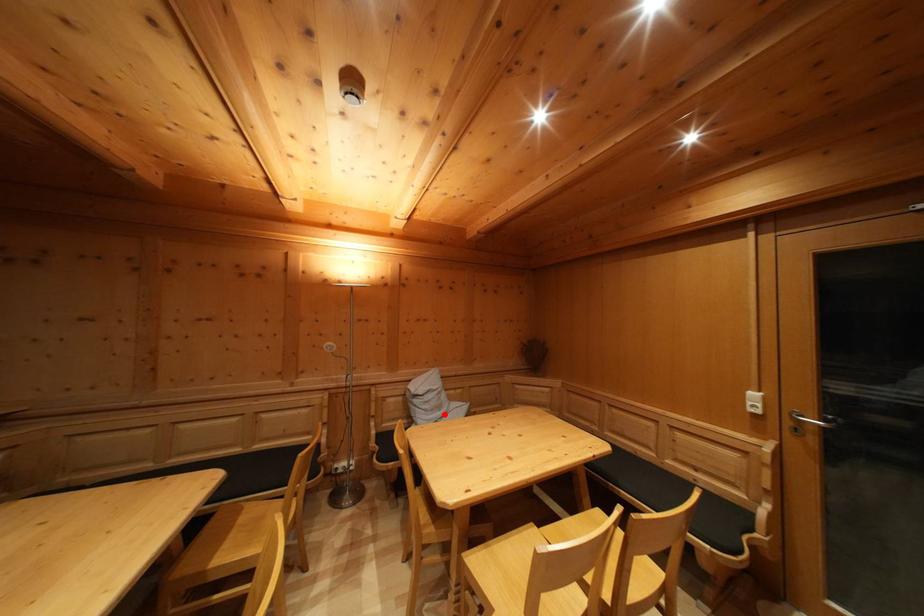
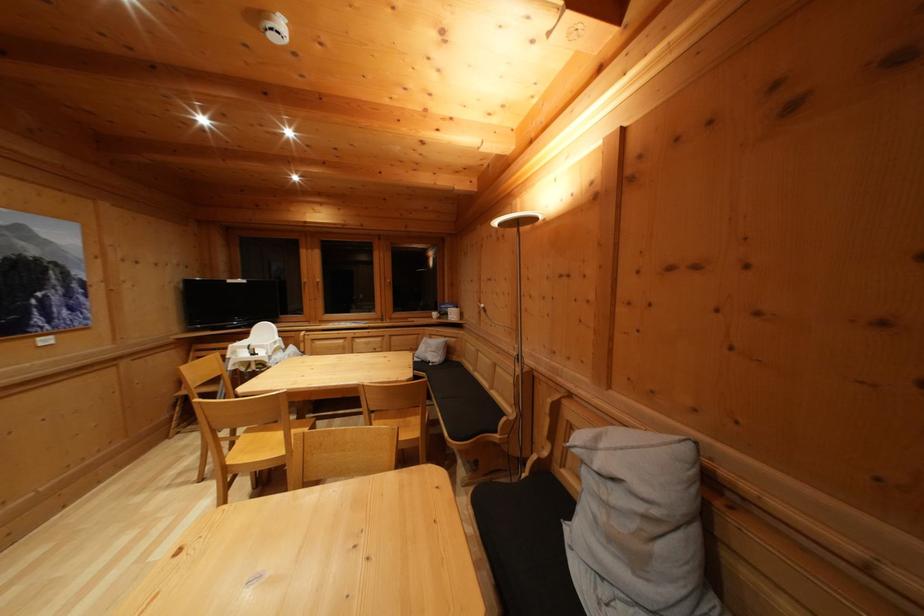
Question: I am providing you with two images of the same scene from different viewpoints. Given a red point in image1, look at the same physical point in image2. Is it:

Choices:
 (A) Closer to the viewpoint
 (B) Farther from the viewpoint

Answer: (A)